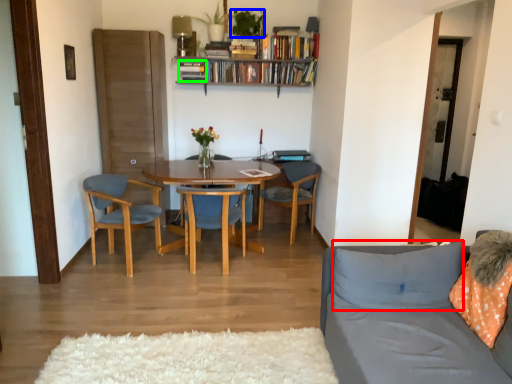
Question: Which object is positioned farthest from pillow (highlighted by a red box)? Select from houseplant (highlighted by a blue box) and book (highlighted by a green box).

Choices:
 (A) houseplant
 (B) book

Answer: (B)